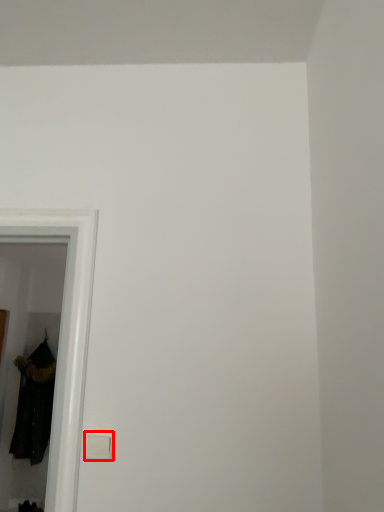
Question: In this image, where is light switch (annotated by the red box) located relative to clothing?

Choices:
 (A) right
 (B) left

Answer: (A)